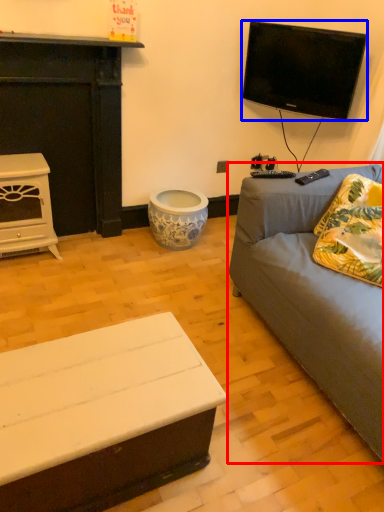
Question: Among these objects, which one is nearest to the camera, studio couch (highlighted by a red box) or television (highlighted by a blue box)?

Choices:
 (A) studio couch
 (B) television

Answer: (A)